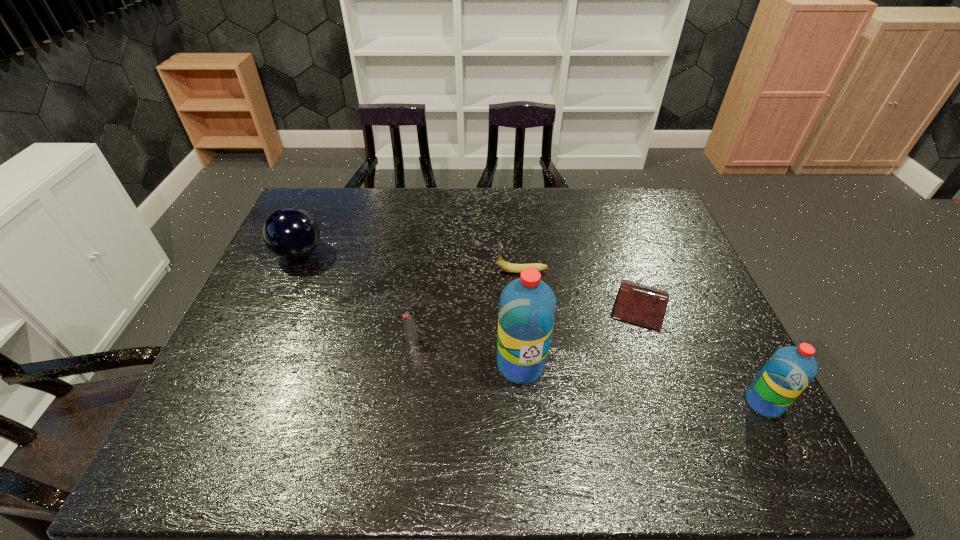
Where is `vacant space in between the leftmost object and the banana`? The image size is (960, 540). vacant space in between the leftmost object and the banana is located at coordinates (411, 262).

Image resolution: width=960 pixels, height=540 pixels. I want to click on unoccupied position between the nearest object and the fourth nearest object, so click(702, 354).

You are a GUI agent. You are given a task and a screenshot of the screen. Output one action in this format:
    pyautogui.click(x=<x>, y=<y>)
    Task: Click on the free space between the leftmost object and the fourth nearest object
    The image size is (960, 540).
    Given the screenshot: What is the action you would take?
    pyautogui.click(x=469, y=279)

What are the coordinates of `empty space between the rightmost object and the banana` in the screenshot? It's located at (643, 337).

Identify the location of free space between the tallest object and the fourth farthest object. (467, 352).

At what (x,y) coordinates should I click in order to perform the action: click on empty location between the right water bottle and the second nearest object. Please return your answer as a coordinate pair (x, y). Looking at the image, I should click on (642, 383).

Locate an element on the screen. Image resolution: width=960 pixels, height=540 pixels. vacant area that lies between the banana and the third tallest object is located at coordinates (411, 262).

Select which object is the closest to the second tallest object. Please provide its 2D coordinates. Your answer should be formatted as a tuple, i.e. [(x, y)], where the tuple contains the x and y coordinates of a point satisfying the conditions above.

[(643, 305)]

I want to click on object that stands as the fifth closest to the banana, so click(x=787, y=373).

Where is `blank space that satisfies the following two spatial constraints: 1. at the stem of the banana; 2. on the front label of the taller water bottle`? Image resolution: width=960 pixels, height=540 pixels. blank space that satisfies the following two spatial constraints: 1. at the stem of the banana; 2. on the front label of the taller water bottle is located at coordinates 532,364.